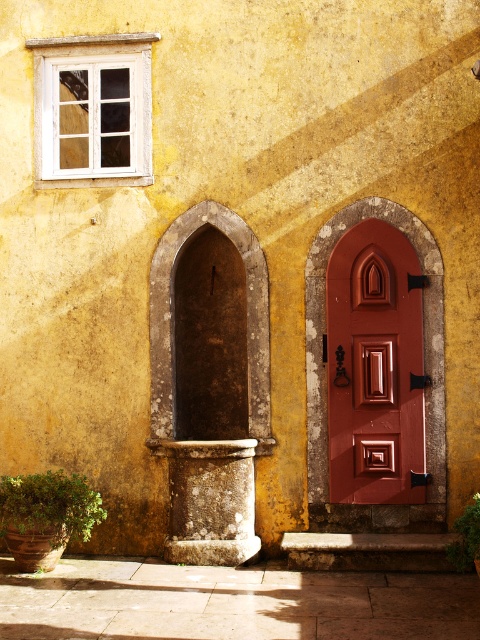
Can you confirm if matte wood door at center is positioned to the left of stone pedestal at center?

Incorrect, matte wood door at center is not on the left side of stone pedestal at center.

Between point (385, 467) and point (236, 516), which one is positioned behind?

The point (385, 467) is behind.

The width and height of the screenshot is (480, 640). In order to click on matte wood door at center in this screenshot , I will do `click(374, 368)`.

You are a GUI agent. You are given a task and a screenshot of the screen. Output one action in this format:
    pyautogui.click(x=<x>, y=<y>)
    Task: Click on the matte wood door at center
    
    Given the screenshot: What is the action you would take?
    pyautogui.click(x=374, y=368)

Which of these two, matte wood door at center or brown stone archway at center, stands shorter?

brown stone archway at center is shorter.

Between matte wood door at center and brown stone archway at center, which one appears on the left side from the viewer's perspective?

brown stone archway at center

Between point (339, 380) and point (254, 243), which one is positioned behind?

Positioned behind is point (254, 243).

Where is `matte wood door at center`? The image size is (480, 640). matte wood door at center is located at coordinates (374, 368).

Is point (376, 353) farther from camera compared to point (141, 118)?

No, (376, 353) is in front of (141, 118).

Looking at this image, does matte wood door at center have a larger size compared to white wooden window at upper left?

Actually, matte wood door at center might be smaller than white wooden window at upper left.

You are a GUI agent. You are given a task and a screenshot of the screen. Output one action in this format:
    pyautogui.click(x=<x>, y=<y>)
    Task: Click on the matte wood door at center
    The height and width of the screenshot is (640, 480).
    Given the screenshot: What is the action you would take?
    pyautogui.click(x=374, y=368)